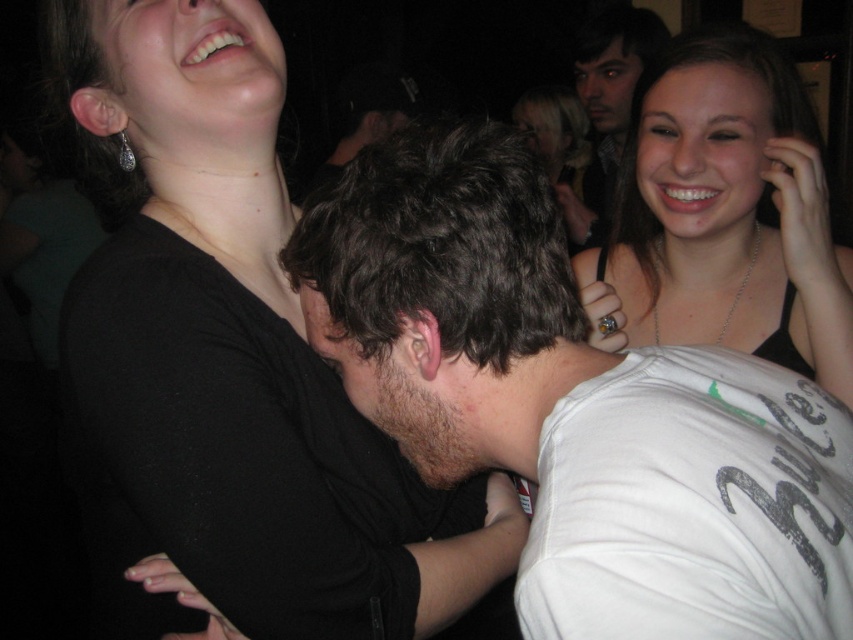
You are a photographer at the party and want to capture a candid shot of both the black matte shirt at upper left and the matte black tank top at upper right in the same frame. Given their distance apart, is it feasible to include both in a single photo without zooming in?

The black matte shirt at upper left is 52.46 centimeters away from the matte black tank top at upper right. Since this distance is relatively short, it is feasible to capture both in a single photo without zooming in, provided the camera has an appropriate lens or framing.

In the social scene described, where is the dark brown hair at center in relation to the matte black tank top at upper right?

The dark brown hair at center is located to the left of the matte black tank top at upper right.

You are organizing a charity event and need to arrange two black clothing items on a display rack. The black matte shirt at upper left and the matte black tank top at upper right are available. Which clothing item has a greater width for better visibility on the rack?

The black matte shirt at upper left has a greater width than the matte black tank top at upper right, making it more visible on the display rack.